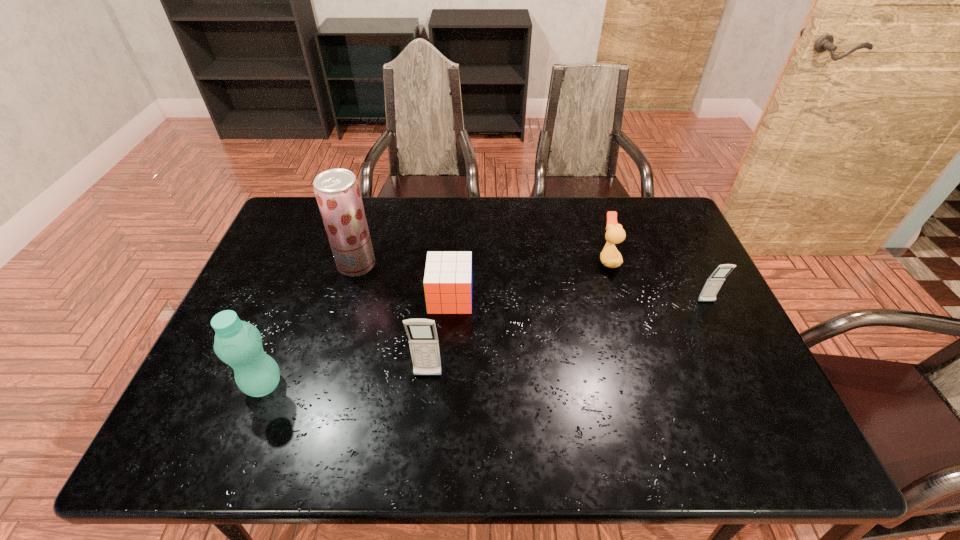
Locate an element on the screen. the left cellular telephone is located at coordinates (423, 340).

Identify the location of the taller cellular telephone. This screenshot has height=540, width=960. (423, 340).

You are a GUI agent. You are given a task and a screenshot of the screen. Output one action in this format:
    pyautogui.click(x=<x>, y=<y>)
    Task: Click on the shorter cellular telephone
    This screenshot has width=960, height=540.
    Given the screenshot: What is the action you would take?
    pyautogui.click(x=713, y=284)

This screenshot has width=960, height=540. I want to click on the right cellular telephone, so click(713, 284).

Where is `fruit juice`? The height and width of the screenshot is (540, 960). fruit juice is located at coordinates (337, 191).

The height and width of the screenshot is (540, 960). I want to click on the fifth object from right to left, so click(337, 191).

The image size is (960, 540). I want to click on cube, so click(447, 282).

Where is `the second object from right to left`? This screenshot has height=540, width=960. the second object from right to left is located at coordinates (610, 257).

The height and width of the screenshot is (540, 960). What are the coordinates of `the leftmost object` in the screenshot? It's located at (237, 343).

Identify the location of free space located 0.080m on the front-facing side of the taller cellular telephone. (424, 413).